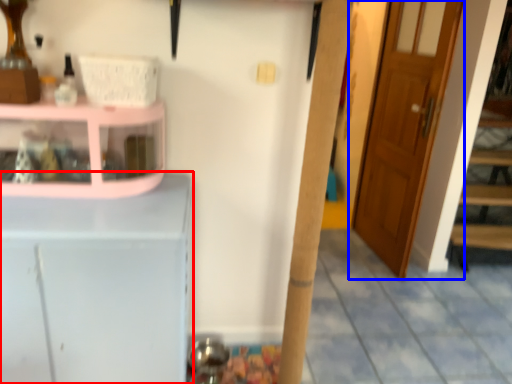
Question: Which object appears farthest to the camera in this image, cabinetry (highlighted by a red box) or door (highlighted by a blue box)?

Choices:
 (A) cabinetry
 (B) door

Answer: (B)